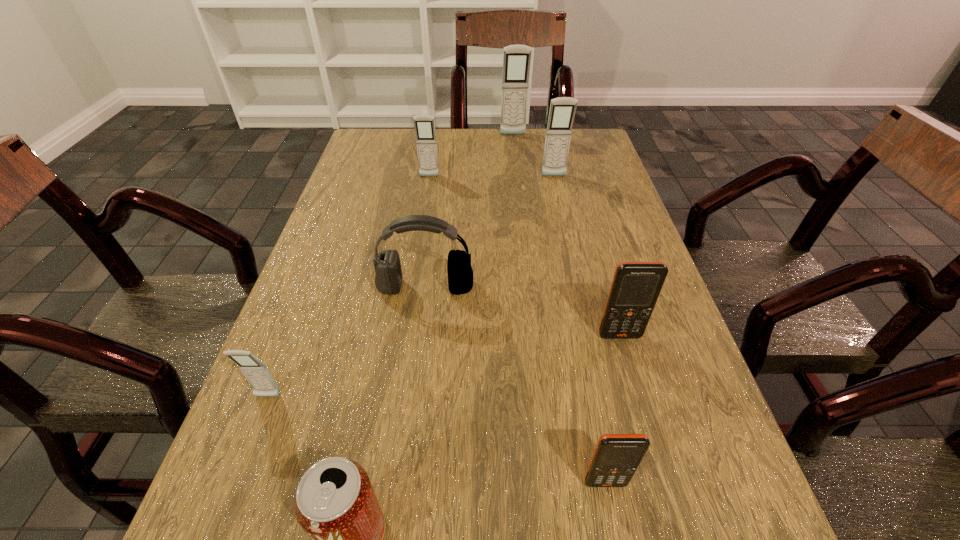
Where is `the farthest object`? This screenshot has height=540, width=960. the farthest object is located at coordinates (516, 58).

Identify the location of the farthest cellular telephone. This screenshot has width=960, height=540. (516, 58).

Identify the location of the second tallest cellular telephone. (562, 110).

Identify the location of the rightmost gray cellular telephone. This screenshot has width=960, height=540. (562, 110).

What are the coordinates of `the second cellular telephone from left to right` in the screenshot? It's located at (424, 125).

Where is `the third gray cellular telephone from right to left`? This screenshot has height=540, width=960. the third gray cellular telephone from right to left is located at coordinates (424, 125).

Where is `the right orange cellular telephone`? The height and width of the screenshot is (540, 960). the right orange cellular telephone is located at coordinates (635, 288).

Image resolution: width=960 pixels, height=540 pixels. I want to click on the farther orange cellular telephone, so click(635, 288).

I want to click on headset, so click(x=388, y=279).

Where is `black headset`? The width and height of the screenshot is (960, 540). black headset is located at coordinates (388, 279).